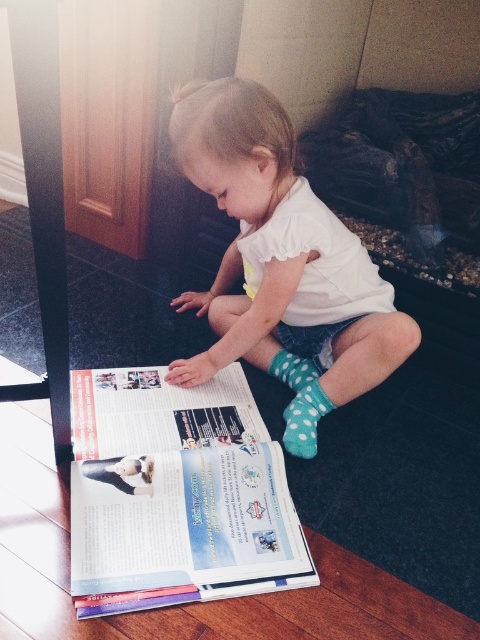
You are a parent trying to ensure your child can easily read the text in the white glossy magazine at center. Considering the blue dotted sock at lower center is blocking part of the magazine, can you determine if the magazine is tall enough to still be readable despite the obstruction?

The white glossy magazine at center is much taller than the blue dotted sock at lower center, so even if the sock is blocking part of it, the remaining visible portion of the magazine should still be tall enough for the child to read the text comfortably.

The child is wearing two socks. The white polka dot socks at center and the blue dotted sock at lower center. Which sock is wider?

The white polka dot socks at center is wider than the blue dotted sock at lower center.